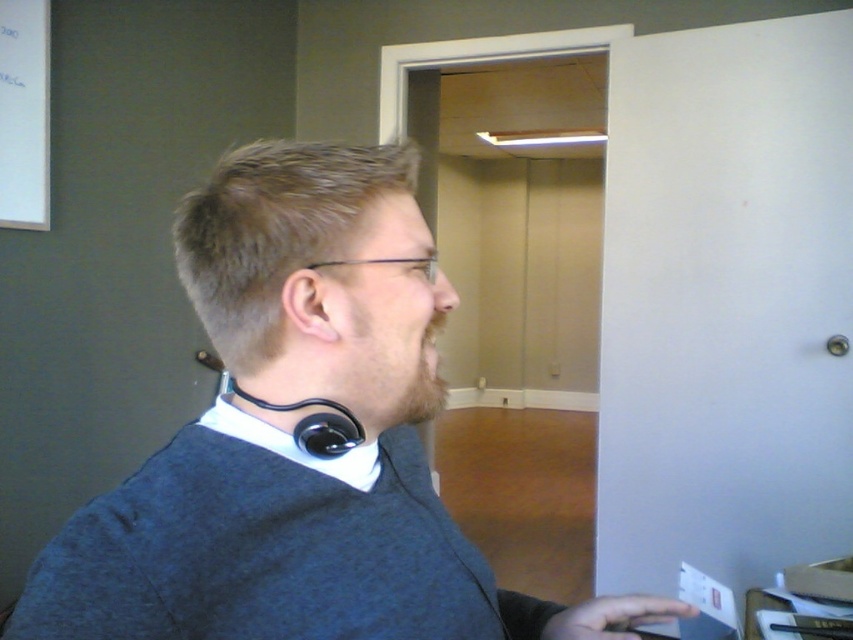
From the picture: You are an office worker who needs to locate the dark gray sweater at center in the image. The office has a coordinate system where the bottom left corner is the origin point. The coordinates provided are normalized between 0 and 1. Can you confirm if the point at coordinates point (299, 442) is the correct location for the dark gray sweater at center?

Yes, the point at coordinates point (299, 442) is the correct location for the dark gray sweater at center as indicated in the description.

You are a tailor who needs to adjust the size of the dark gray sweater at center and the skinny black ear at center. Which item requires more fabric to accommodate a larger size?

The dark gray sweater at center requires more fabric to accommodate a larger size since it has a larger size compared to the skinny black ear at center.

You are an interior designer assessing the office layout. The dark gray sweater at center and the skinny black ear at center are both placed on the desk. If you want to move a new object between them, what should you consider about their widths?

The dark gray sweater at center might be wider than the skinny black ear at center, so you should check their actual widths to ensure enough space for the new object between them.